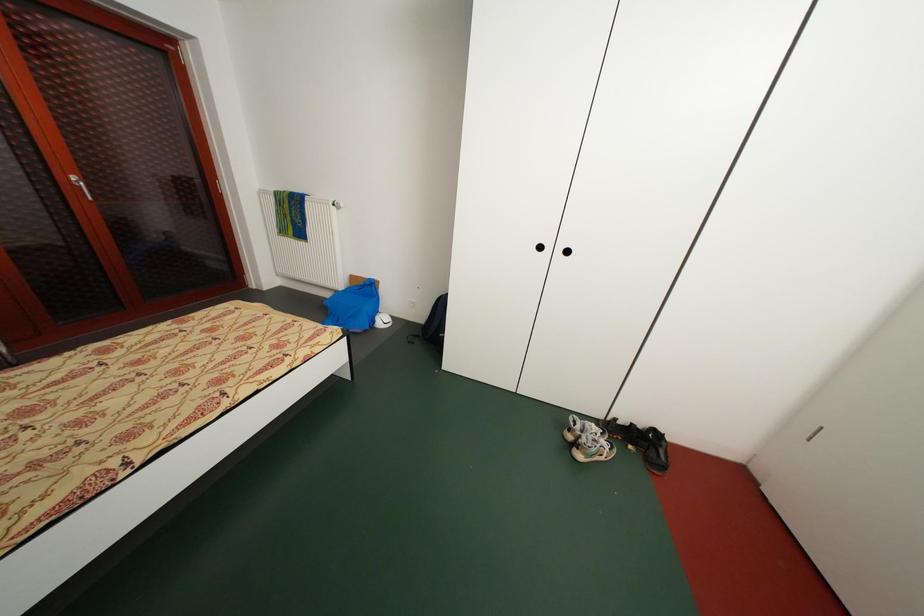
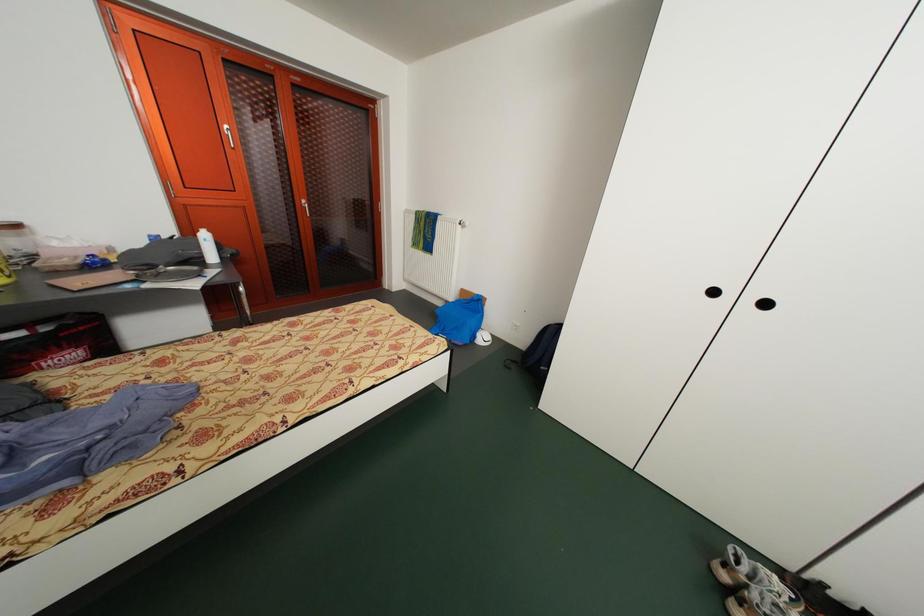
Question: The first image is from the beginning of the video and the second image is from the end. How did the camera likely rotate when shooting the video?

Choices:
 (A) Left
 (B) Right
 (C) Up
 (D) Down

Answer: (A)